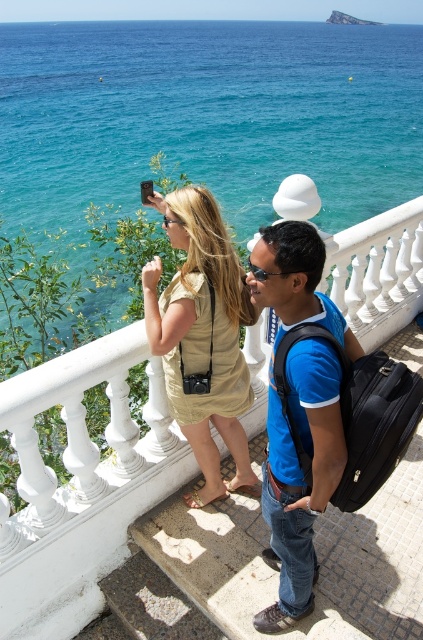
Question: Which object is the farthest from the blue cotton shirt at center?

Choices:
 (A) black fabric backpack at center
 (B) matte gold dress at center
 (C) blue water at upper center

Answer: (C)

Question: Among these points, which one is nearest to the camera?

Choices:
 (A) (62, 564)
 (B) (175, 209)
 (C) (24, 205)
 (D) (340, 348)

Answer: (D)

Question: Is matte gold dress at center positioned at the back of black fabric backpack at center?

Choices:
 (A) yes
 (B) no

Answer: (A)

Question: Considering the relative positions of white marble railing at upper center and black fabric backpack at center in the image provided, where is white marble railing at upper center located with respect to black fabric backpack at center?

Choices:
 (A) above
 (B) below

Answer: (B)

Question: From the image, what is the correct spatial relationship of blue cotton shirt at center in relation to black fabric backpack at center?

Choices:
 (A) left
 (B) right

Answer: (A)

Question: Based on their relative distances, which object is farther from the white marble railing at upper center?

Choices:
 (A) matte gold dress at center
 (B) black fabric backpack at center
 (C) blue water at upper center
 (D) blue cotton shirt at center

Answer: (C)